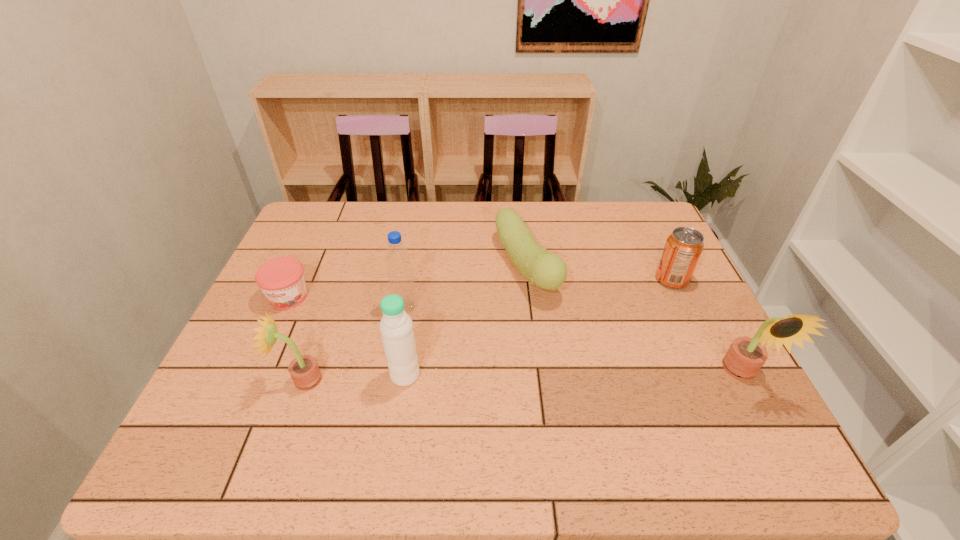
Select which object is the closest to the nearer water bottle. Please provide its 2D coordinates. Your answer should be formatted as a tuple, i.e. [(x, y)], where the tuple contains the x and y coordinates of a point satisfying the conditions above.

[(397, 258)]

Where is `object that can be found as the fourth closest to the fourth tallest object`? The height and width of the screenshot is (540, 960). object that can be found as the fourth closest to the fourth tallest object is located at coordinates (548, 271).

The width and height of the screenshot is (960, 540). Identify the location of free space that satisfies the following two spatial constraints: 1. on the front side of the nearer water bottle; 2. on the face of the sixth object from right to left. (404, 380).